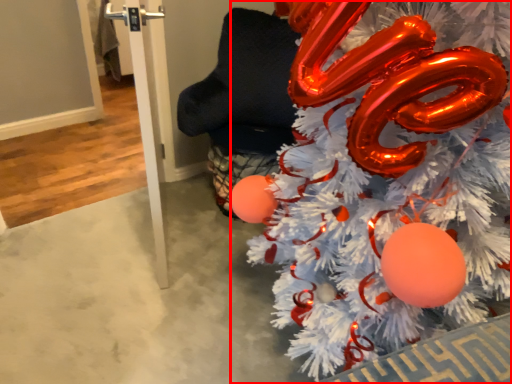
Question: From the image's perspective, what is the correct spatial relationship of christmas tree (annotated by the red box) in relation to pole?

Choices:
 (A) below
 (B) above

Answer: (A)